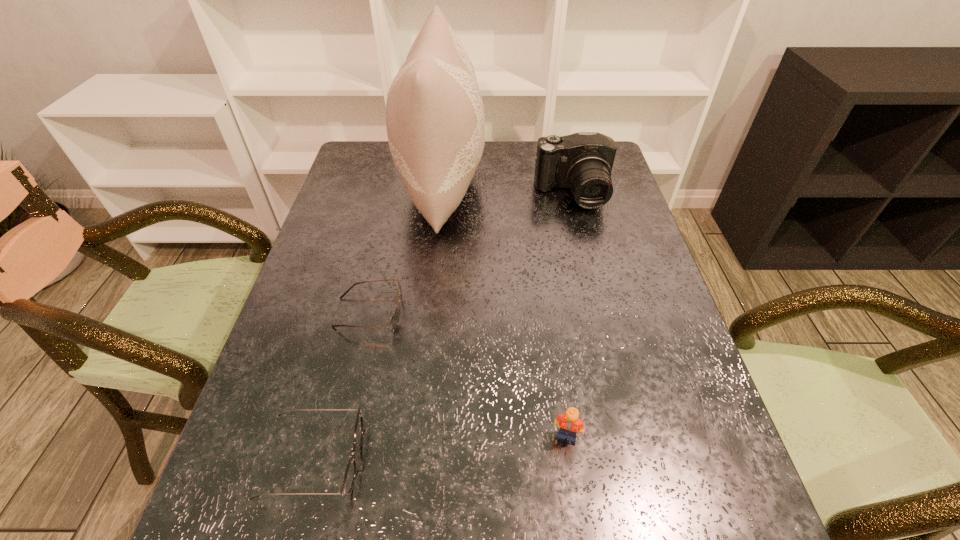
I want to click on the tallest object, so click(x=435, y=121).

This screenshot has height=540, width=960. Identify the location of the second tallest object. (583, 161).

Find the location of `Lego`. Lego is located at coordinates (570, 422).

Locate an element on the screen. the third farthest object is located at coordinates pos(394,320).

At what (x,y) coordinates should I click in order to perform the action: click on spectacles. Please return your answer as a coordinate pair (x, y). The height and width of the screenshot is (540, 960). Looking at the image, I should click on (350, 475).

You are a GUI agent. You are given a task and a screenshot of the screen. Output one action in this format:
    pyautogui.click(x=<x>, y=<y>)
    Task: Click on the vacant space situated 0.110m on the front side of the tallest object
    The image size is (960, 540).
    Given the screenshot: What is the action you would take?
    pyautogui.click(x=520, y=186)

Locate an element on the screen. This screenshot has height=540, width=960. vacant space located 0.350m on the lens of the second tallest object is located at coordinates (601, 305).

The image size is (960, 540). I want to click on free region located 0.140m on the front-facing side of the third shortest object, so click(580, 529).

At what (x,y) coordinates should I click in order to perform the action: click on vacant region located on the front-facing side of the sunglasses. Please return your answer as a coordinate pair (x, y). Looking at the image, I should click on (525, 313).

Image resolution: width=960 pixels, height=540 pixels. I want to click on vacant area situated through the lenses of the spectacles, so click(x=445, y=460).